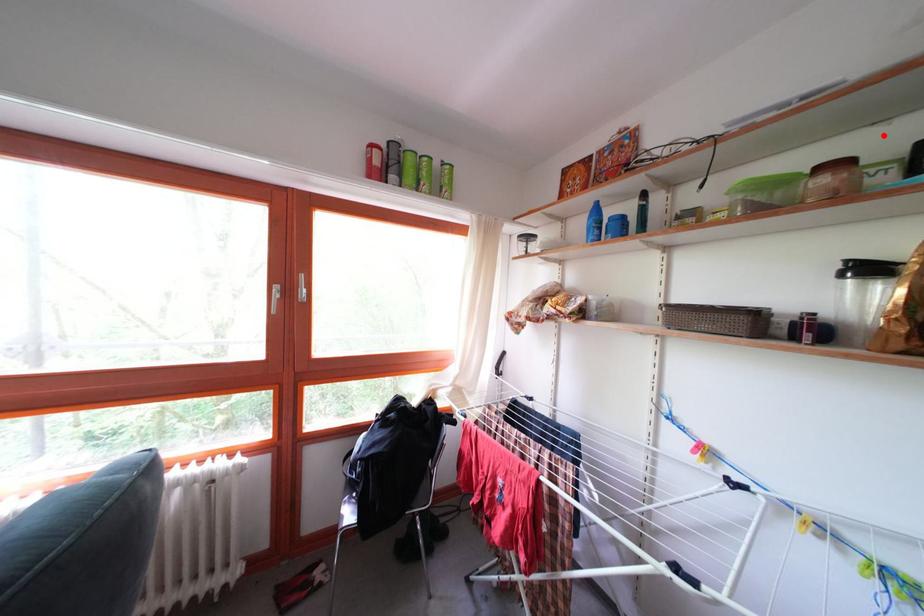
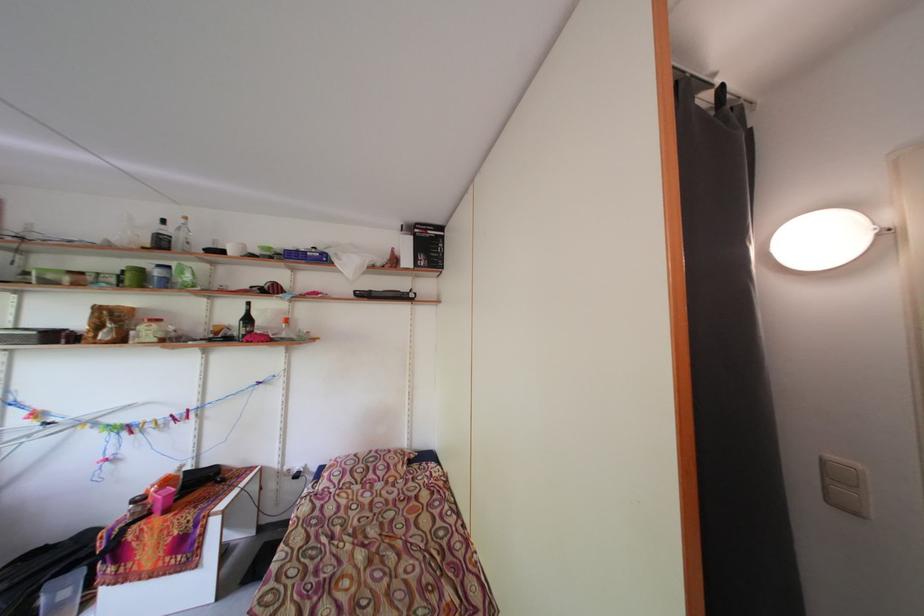
Where in the second image is the point corresponding to the highlighted location from the first image?

(127, 265)